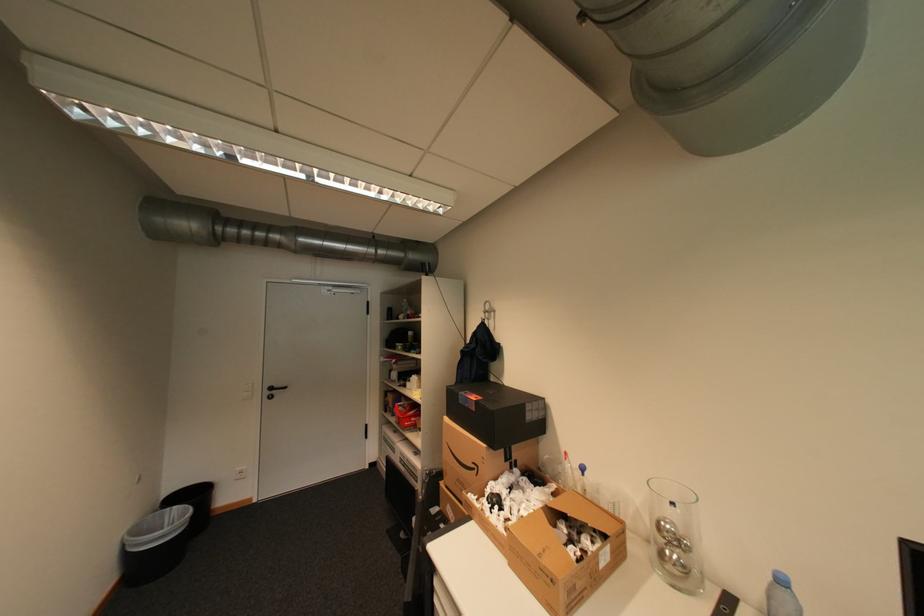
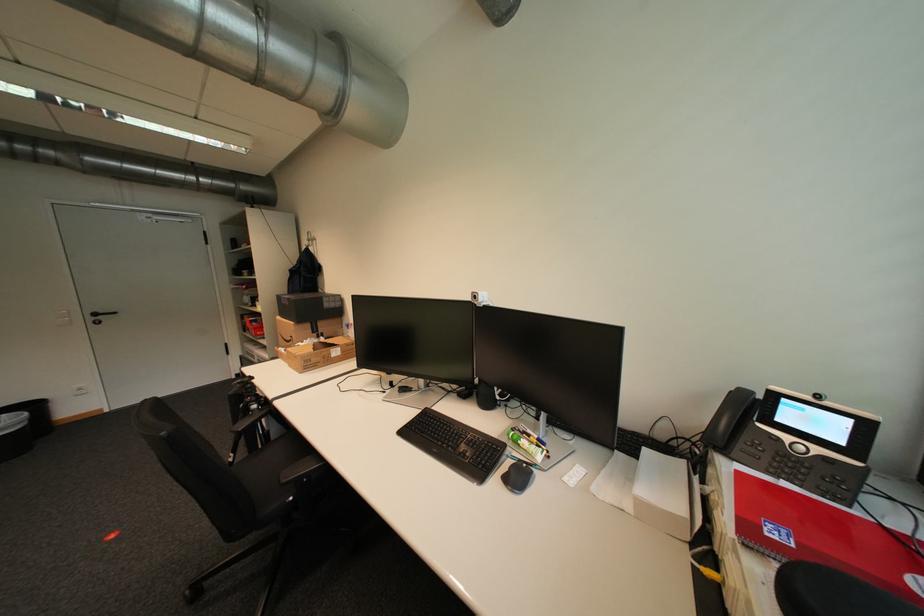
Find the pixel in the second image that matches the point at 184,507 in the first image.

(11, 416)